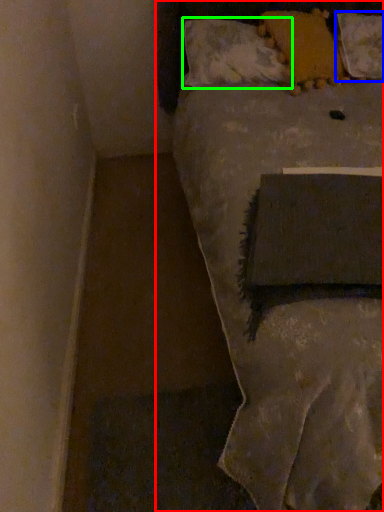
Question: Which is nearer to the bed (highlighted by a red box)? pillow (highlighted by a blue box) or pillow (highlighted by a green box).

Choices:
 (A) pillow
 (B) pillow

Answer: (B)